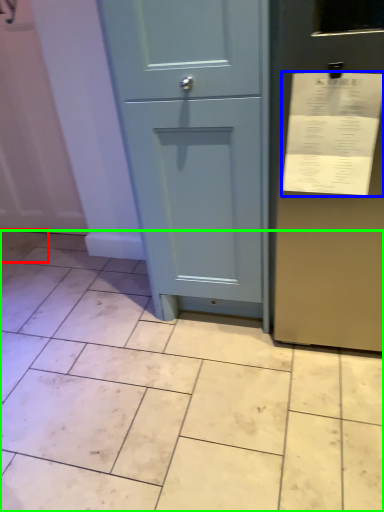
Question: Considering the real-world distances, which object is closest to ceramic tile (highlighted by a red box)? receipt (highlighted by a blue box) or ceramic tile (highlighted by a green box).

Choices:
 (A) receipt
 (B) ceramic tile

Answer: (B)